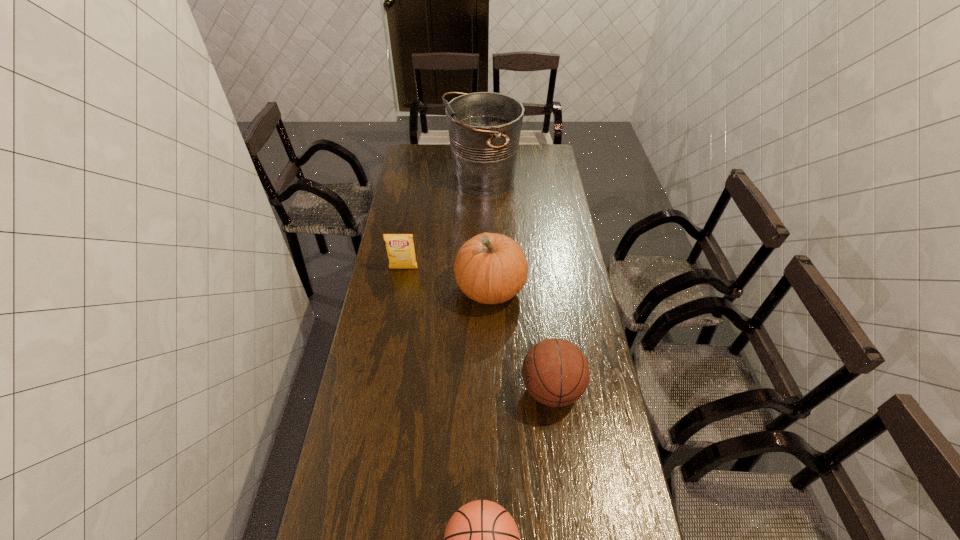
Where is `vacant point located on the side with brand label of the second nearest object`? This screenshot has height=540, width=960. vacant point located on the side with brand label of the second nearest object is located at coordinates (485, 389).

Find the location of a particular element. The height and width of the screenshot is (540, 960). vacant space situated on the side with brand label of the second nearest object is located at coordinates (414, 389).

Where is `free space located 0.210m on the side with brand label of the second nearest object`? Image resolution: width=960 pixels, height=540 pixels. free space located 0.210m on the side with brand label of the second nearest object is located at coordinates (453, 389).

The image size is (960, 540). I want to click on vacant space located on the front of the leftmost object with the logo, so click(x=400, y=289).

Locate an element on the screen. The height and width of the screenshot is (540, 960). object present at the far edge is located at coordinates (484, 128).

I want to click on object located at the left edge, so click(400, 248).

This screenshot has width=960, height=540. What are the coordinates of `object that is positioned at the right edge` in the screenshot? It's located at (555, 372).

Locate an element on the screen. vacant space at the left edge of the desktop is located at coordinates (340, 461).

I want to click on vacant area at the right edge, so click(x=576, y=303).

The height and width of the screenshot is (540, 960). In order to click on free location at the far left corner of the desktop in this screenshot , I will do `click(416, 154)`.